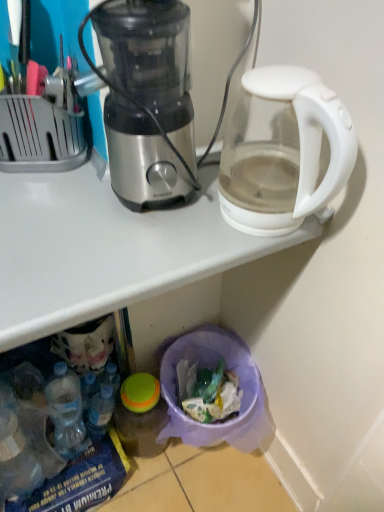
Question: Is translucent plastic bottle at lower left placed right next to transparent glass kettle at upper right?

Choices:
 (A) no
 (B) yes

Answer: (A)

Question: Does translucent plastic bottle at lower left have a lesser height compared to transparent glass kettle at upper right?

Choices:
 (A) yes
 (B) no

Answer: (A)

Question: Is translucent plastic bottle at lower left positioned beyond the bounds of transparent glass kettle at upper right?

Choices:
 (A) yes
 (B) no

Answer: (A)

Question: Does translucent plastic bottle at lower left lie in front of transparent glass kettle at upper right?

Choices:
 (A) no
 (B) yes

Answer: (A)

Question: Is translucent plastic bottle at lower left smaller than transparent glass kettle at upper right?

Choices:
 (A) yes
 (B) no

Answer: (A)

Question: Choose the correct answer: Is transparent glass kettle at upper right inside translucent plastic bottle at lower left or outside it?

Choices:
 (A) outside
 (B) inside

Answer: (A)

Question: In terms of size, does transparent glass kettle at upper right appear bigger or smaller than translucent plastic bottle at lower left?

Choices:
 (A) big
 (B) small

Answer: (A)

Question: Based on their positions, is transparent glass kettle at upper right located to the left or right of translucent plastic bottle at lower left?

Choices:
 (A) right
 (B) left

Answer: (A)

Question: Is transparent glass kettle at upper right taller or shorter than translucent plastic bottle at lower left?

Choices:
 (A) tall
 (B) short

Answer: (A)

Question: Is point (105, 231) positioned closer to the camera than point (104, 398)?

Choices:
 (A) closer
 (B) farther

Answer: (A)

Question: Looking at their shapes, would you say transparent plastic trash bin at lower center is wider or thinner than translucent plastic bottle at lower left?

Choices:
 (A) thin
 (B) wide

Answer: (B)

Question: From their relative heights in the image, would you say transparent plastic trash bin at lower center is taller or shorter than translucent plastic bottle at lower left?

Choices:
 (A) tall
 (B) short

Answer: (A)

Question: Is transparent plastic trash bin at lower center bigger or smaller than translucent plastic bottle at lower left?

Choices:
 (A) big
 (B) small

Answer: (A)

Question: Is point [109, 420] closer or farther from the camera than point [228, 352]?

Choices:
 (A) farther
 (B) closer

Answer: (B)

Question: Based on their positions, is translucent plastic bottle at lower left located to the left or right of translucent plastic trash can at lower center?

Choices:
 (A) left
 (B) right

Answer: (A)